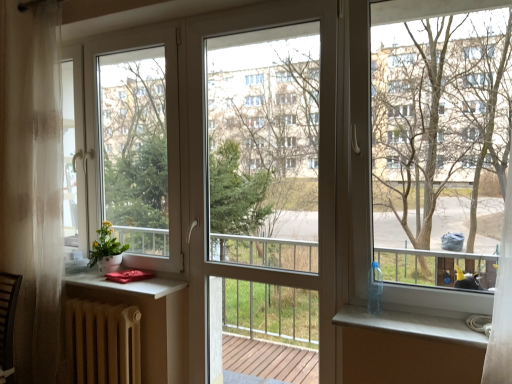
Question: Is bare wood tree at right outside of matte brown radiator at lower left?

Choices:
 (A) yes
 (B) no

Answer: (A)

Question: Could you tell me if bare wood tree at right is turned towards matte brown radiator at lower left?

Choices:
 (A) yes
 (B) no

Answer: (B)

Question: Is bare wood tree at right oriented away from matte brown radiator at lower left?

Choices:
 (A) no
 (B) yes

Answer: (A)

Question: From the image's perspective, is bare wood tree at right below matte brown radiator at lower left?

Choices:
 (A) yes
 (B) no

Answer: (B)

Question: Does bare wood tree at right come behind matte brown radiator at lower left?

Choices:
 (A) no
 (B) yes

Answer: (A)

Question: In the image, is bare wood tree at right positioned in front of or behind matte white pot at left?

Choices:
 (A) behind
 (B) front

Answer: (B)

Question: From a real-world perspective, is bare wood tree at right above or below matte white pot at left?

Choices:
 (A) below
 (B) above

Answer: (B)

Question: Which is correct: bare wood tree at right is inside matte white pot at left, or outside of it?

Choices:
 (A) outside
 (B) inside

Answer: (A)

Question: From the image's perspective, is bare wood tree at right positioned above or below matte white pot at left?

Choices:
 (A) below
 (B) above

Answer: (B)

Question: Is transparent glass screen door at center inside or outside of bare wood tree at right?

Choices:
 (A) inside
 (B) outside

Answer: (B)

Question: In terms of size, does transparent glass screen door at center appear bigger or smaller than bare wood tree at right?

Choices:
 (A) big
 (B) small

Answer: (B)

Question: Considering the positions of transparent glass screen door at center and bare wood tree at right in the image, is transparent glass screen door at center wider or thinner than bare wood tree at right?

Choices:
 (A) wide
 (B) thin

Answer: (B)

Question: Visually, is transparent glass screen door at center positioned to the left or to the right of bare wood tree at right?

Choices:
 (A) right
 (B) left

Answer: (B)

Question: Is point (168, 317) closer or farther from the camera than point (253, 314)?

Choices:
 (A) closer
 (B) farther

Answer: (A)

Question: Considering the positions of matte brown radiator at lower left and transparent glass screen door at center in the image, is matte brown radiator at lower left taller or shorter than transparent glass screen door at center?

Choices:
 (A) short
 (B) tall

Answer: (A)